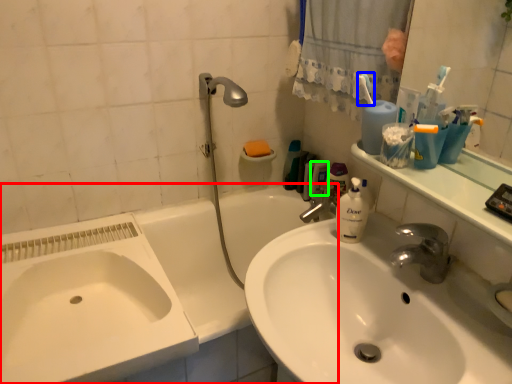
Question: Which object is the closest to the bathtub (highlighted by a red box)? Choose among these: toothbrush (highlighted by a blue box) or mouthwash (highlighted by a green box).

Choices:
 (A) toothbrush
 (B) mouthwash

Answer: (B)